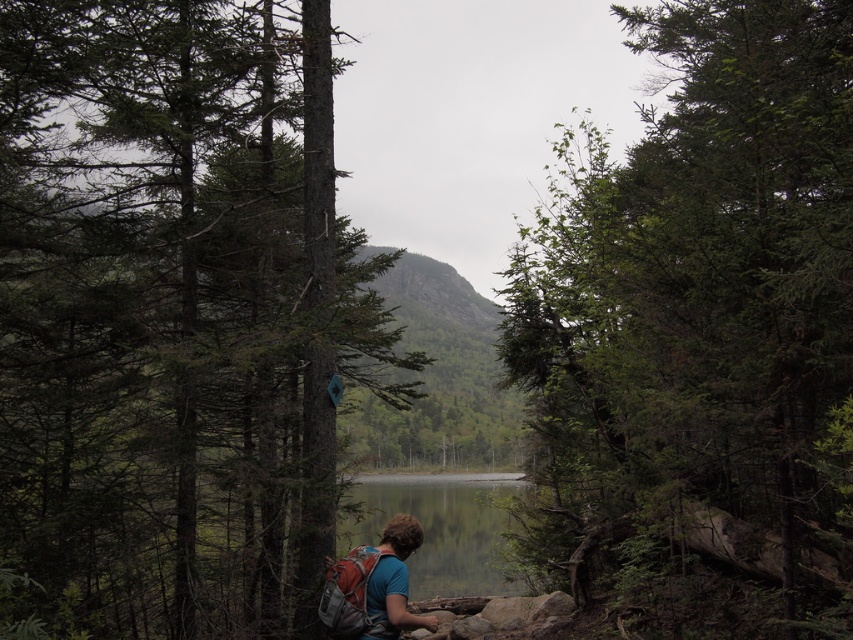
Between point (801, 406) and point (358, 484), which one is positioned behind?

The point (358, 484) is more distant.

This screenshot has height=640, width=853. What are the coordinates of `green leafy tree at center` in the screenshot? It's located at (699, 333).

Does point (178, 257) come closer to viewer compared to point (720, 634)?

That is False.

Is green matte tree at center shorter than green leafy tree at center?

Indeed, green matte tree at center has a lesser height compared to green leafy tree at center.

Between point (231, 326) and point (805, 401), which one is positioned in front?

Point (805, 401)

Identify the location of green matte tree at center. This screenshot has height=640, width=853. (166, 324).

Is green matte tree at center smaller than clear water at center?

No, green matte tree at center is not smaller than clear water at center.

Which of these two, green matte tree at center or clear water at center, stands taller?

With more height is green matte tree at center.

Does point (253, 602) come in front of point (456, 508)?

That is True.

The height and width of the screenshot is (640, 853). Identify the location of green matte tree at center. (166, 324).